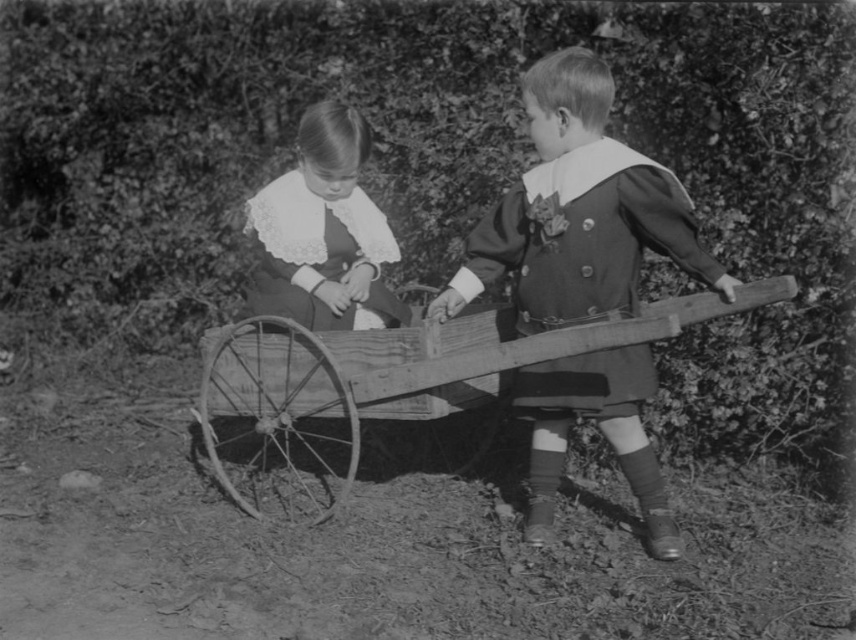
You are a photographer analyzing this image. You have two points marked in the scene, point A at coordinates point (x=633, y=150) and point B at coordinates point (x=578, y=288). Which point is closer to the camera?

Point A at coordinates point (x=633, y=150) is closer to the camera than point B at coordinates point (x=578, y=288).

You are standing at the origin point in the image. There are two points marked in the scene. Which point is closer to you, point (634,49) or point (301,224)?

Point (301,224) is closer to you because it has a smaller y coordinate than point (634,49). In the coordinate system, lower y values mean closer to the viewer.